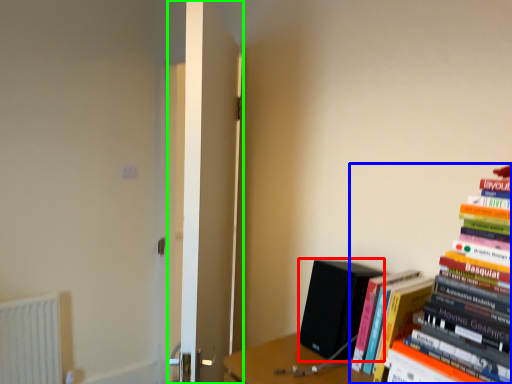
Question: Considering the real-world distances, which object is farthest from paperback book (highlighted by a red box)? book (highlighted by a blue box) or door (highlighted by a green box)?

Choices:
 (A) book
 (B) door

Answer: (B)